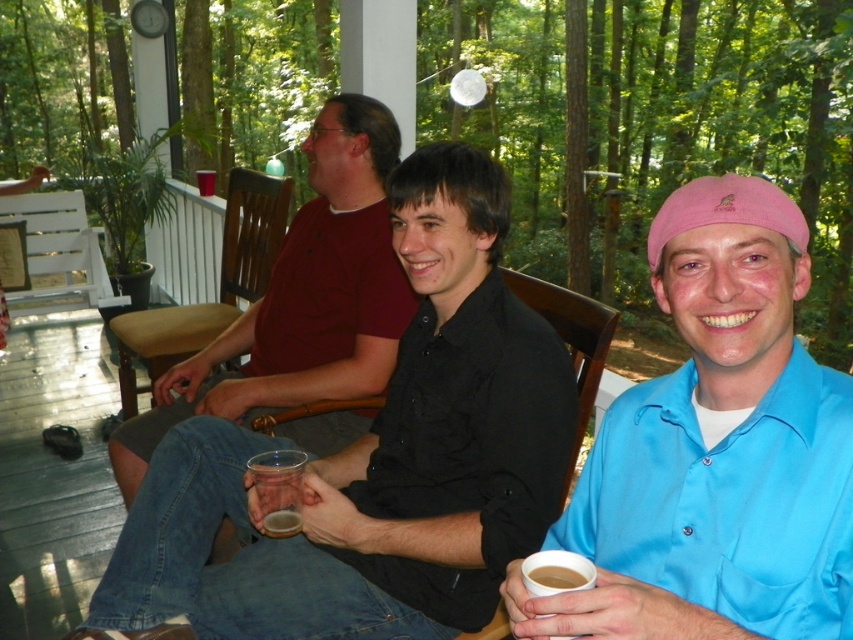
Is point (434, 496) positioned after point (697, 396)?

Yes, it is behind point (697, 396).

Identify the location of black matte shirt at center. This screenshot has height=640, width=853. (376, 460).

Does point (401, 166) lie behind point (799, 371)?

Yes, it is behind point (799, 371).

Identify the location of black matte shirt at center. (376, 460).

Who is positioned more to the left, translucent plastic cup at center or white paper cup at lower right?

Positioned to the left is translucent plastic cup at center.

Does translucent plastic cup at center appear under white paper cup at lower right?

Yes.

Is point (289, 515) less distant than point (567, 572)?

No, it is not.

At what (x,y) coordinates should I click in order to perform the action: click on translucent plastic cup at center. Please return your answer as a coordinate pair (x, y). Looking at the image, I should click on (277, 490).

Which is below, pink fabric cap at upper right or brown matte cup at lower center?

Positioned lower is brown matte cup at lower center.

Who is more distant from viewer, (845, 524) or (537, 582)?

Point (845, 524)

Is point (734, 308) in front of point (566, 566)?

No, (734, 308) is behind (566, 566).

At what (x,y) coordinates should I click in order to perform the action: click on pink fabric cap at upper right. Please return your answer as a coordinate pair (x, y). The width and height of the screenshot is (853, 640). Looking at the image, I should click on (717, 449).